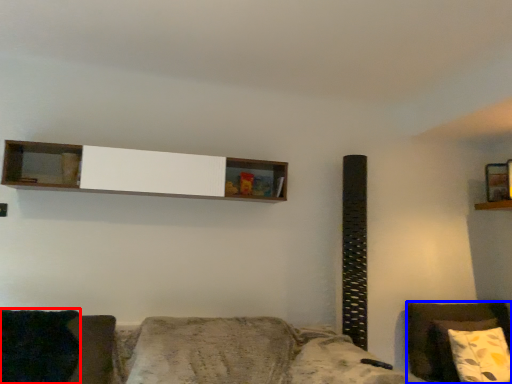
Question: Which object is further to the camera taking this photo, pillow (highlighted by a red box) or furniture (highlighted by a blue box)?

Choices:
 (A) pillow
 (B) furniture

Answer: (B)